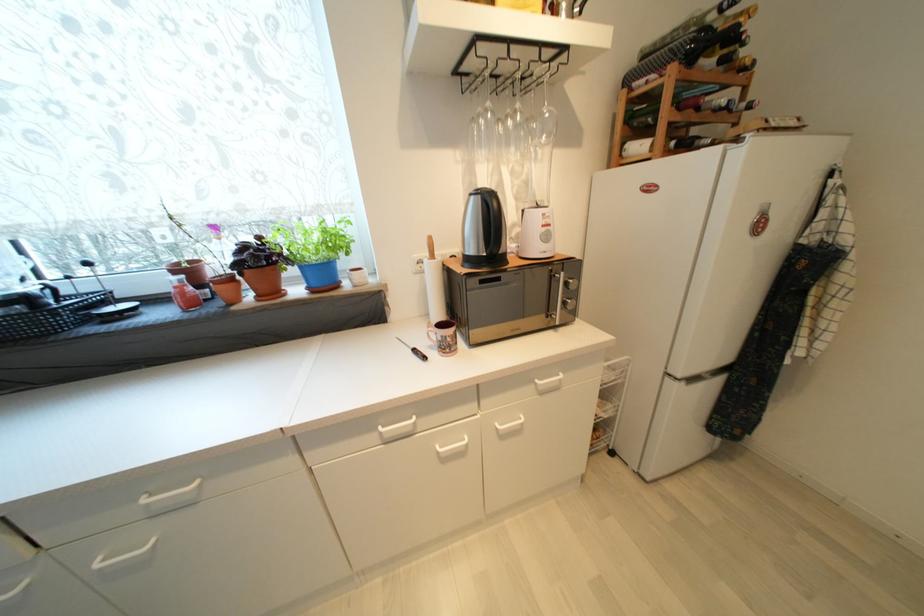
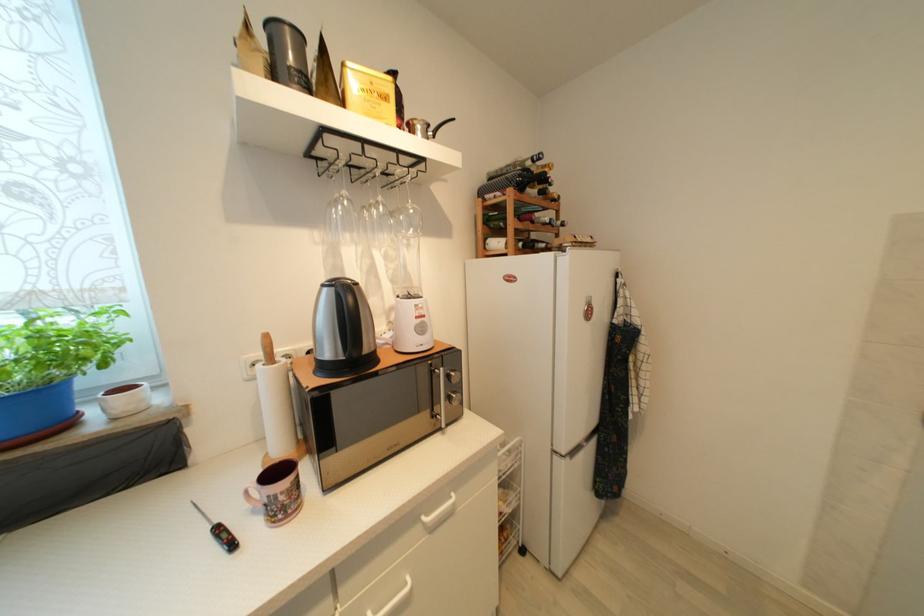
In the second image, find the point that corresponds to point 455,333 in the first image.

(289, 485)